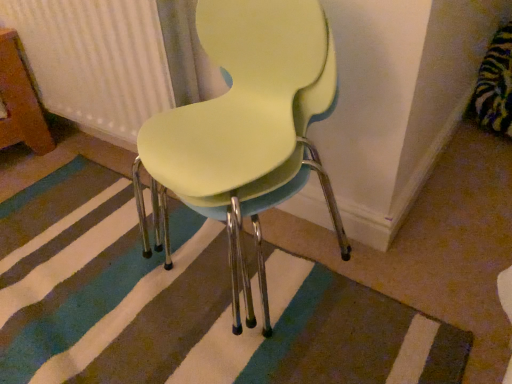
Identify the location of matte yellow plastic chair at center. The height and width of the screenshot is (384, 512). (245, 129).

Would you say matte yellow plastic chair at center is outside striped carpet at center?

Yes, matte yellow plastic chair at center is located beyond the bounds of striped carpet at center.

Which of these two, matte yellow plastic chair at center or striped carpet at center, stands shorter?

Standing shorter between the two is striped carpet at center.

Is matte yellow plastic chair at center bigger than striped carpet at center?

Correct, matte yellow plastic chair at center is larger in size than striped carpet at center.

Between matte yellow plastic chair at center and striped carpet at center, which one appears on the right side from the viewer's perspective?

matte yellow plastic chair at center.

Would you say striped carpet at center contains matte yellow plastic chair at center?

No.

Is striped carpet at center wider or thinner than matte yellow plastic chair at center?

Considering their sizes, striped carpet at center looks broader than matte yellow plastic chair at center.

Would you say striped carpet at center is a long distance from matte yellow plastic chair at center?

No, striped carpet at center is in close proximity to matte yellow plastic chair at center.

Can you confirm if white textured radiator at upper left is wider than matte yellow plastic chair at center?

No.

Looking at this image, is white textured radiator at upper left situated inside matte yellow plastic chair at center or outside?

white textured radiator at upper left lies outside matte yellow plastic chair at center.

Considering the positions of point (156, 8) and point (176, 168), is point (156, 8) closer or farther from the camera than point (176, 168)?

Point (156, 8).

Is striped carpet at center beside white textured radiator at upper left?

striped carpet at center is not next to white textured radiator at upper left, and they're not touching.

Is point (96, 348) closer to camera compared to point (151, 51)?

Yes, point (96, 348) is closer to viewer.

Who is taller, striped carpet at center or white textured radiator at upper left?

Standing taller between the two is white textured radiator at upper left.

Is striped carpet at center wider or thinner than white textured radiator at upper left?

In the image, striped carpet at center appears to be wider than white textured radiator at upper left.

Where is `chair in front of the white textured radiator at upper left`? Image resolution: width=512 pixels, height=384 pixels. chair in front of the white textured radiator at upper left is located at coordinates (245, 129).

Is the position of matte yellow plastic chair at center less distant than that of white textured radiator at upper left?

That is True.

Does point (246, 178) lie in front of point (10, 0)?

Yes, it is in front of point (10, 0).

Is white textured radiator at upper left to the left or to the right of striped carpet at center in the image?

Based on their positions, white textured radiator at upper left is located to the left of striped carpet at center.

The width and height of the screenshot is (512, 384). I want to click on doormat below the white textured radiator at upper left (from the image's perspective), so pos(186,303).

Is white textured radiator at upper left not close to striped carpet at center?

white textured radiator at upper left is near striped carpet at center, not far away.

From the image's perspective, would you say white textured radiator at upper left is shown under striped carpet at center?

No.

The height and width of the screenshot is (384, 512). Identify the location of chair to the right of striped carpet at center. (245, 129).

Locate an element on the screen. This screenshot has height=384, width=512. chair above the striped carpet at center (from a real-world perspective) is located at coordinates (245, 129).

Estimate the real-world distances between objects in this image. Which object is further from matte yellow plastic chair at center, striped carpet at center or white textured radiator at upper left?

Based on the image, white textured radiator at upper left appears to be further to matte yellow plastic chair at center.

Based on the photo, considering their positions, is white textured radiator at upper left positioned closer to matte yellow plastic chair at center than striped carpet at center?

striped carpet at center lies closer to matte yellow plastic chair at center than the other object.

Looking at this image, estimate the real-world distances between objects in this image. Which object is further from white textured radiator at upper left, matte yellow plastic chair at center or striped carpet at center?

striped carpet at center is further to white textured radiator at upper left.

Estimate the real-world distances between objects in this image. Which object is further from white textured radiator at upper left, striped carpet at center or matte yellow plastic chair at center?

striped carpet at center is positioned further to the anchor white textured radiator at upper left.

Estimate the real-world distances between objects in this image. Which object is closer to striped carpet at center, matte yellow plastic chair at center or white textured radiator at upper left?

matte yellow plastic chair at center lies closer to striped carpet at center than the other object.

Which object lies further to the anchor point striped carpet at center, white textured radiator at upper left or matte yellow plastic chair at center?

white textured radiator at upper left is further to striped carpet at center.

Image resolution: width=512 pixels, height=384 pixels. Find the location of `chair between white textured radiator at upper left and striped carpet at center in the vertical direction`. chair between white textured radiator at upper left and striped carpet at center in the vertical direction is located at coordinates (245, 129).